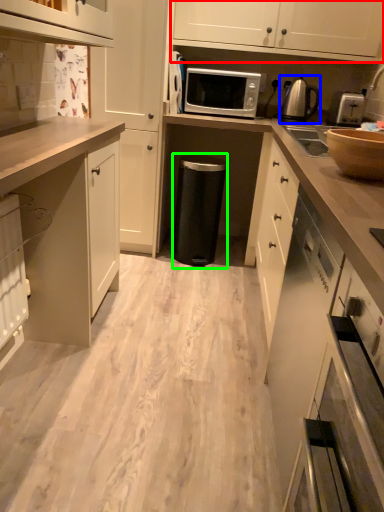
Question: Based on their relative distances, which object is nearer to cabinetry (highlighted by a red box)? Choose from kitchen appliance (highlighted by a blue box) and appliance (highlighted by a green box).

Choices:
 (A) kitchen appliance
 (B) appliance

Answer: (A)